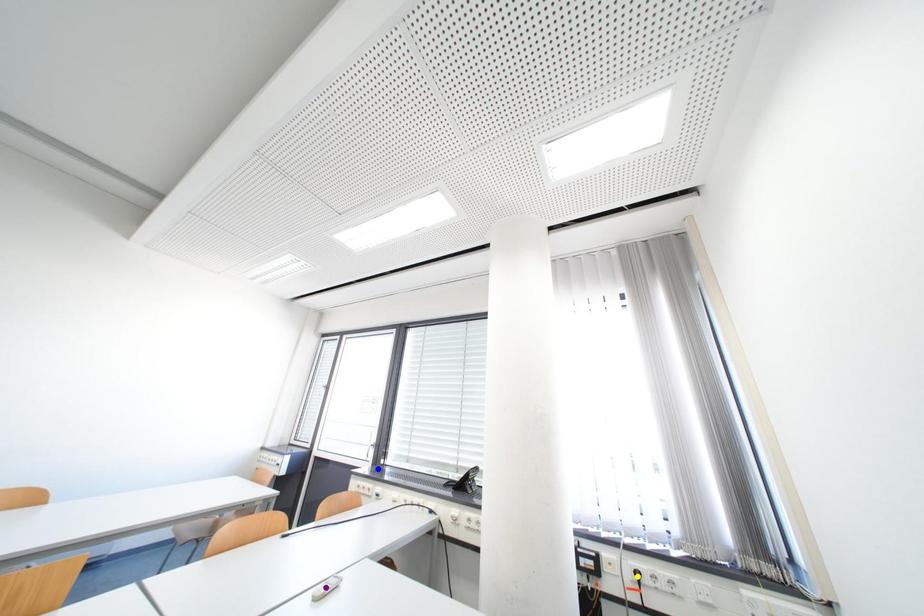
Order these from nearest to farthest:
1. purple point
2. yellow point
3. blue point

blue point < yellow point < purple point